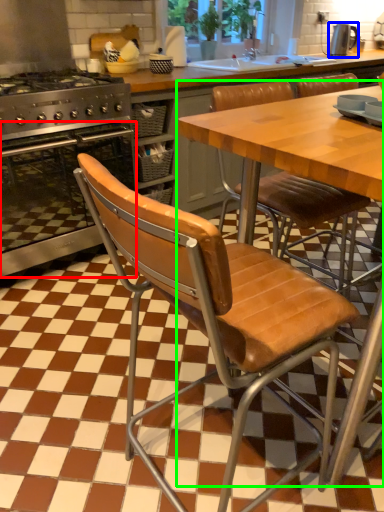
Question: Which object is positioned closest to oven (highlighted by a red box)? Select from kitchen appliance (highlighted by a blue box) and table (highlighted by a green box).

Choices:
 (A) kitchen appliance
 (B) table

Answer: (B)